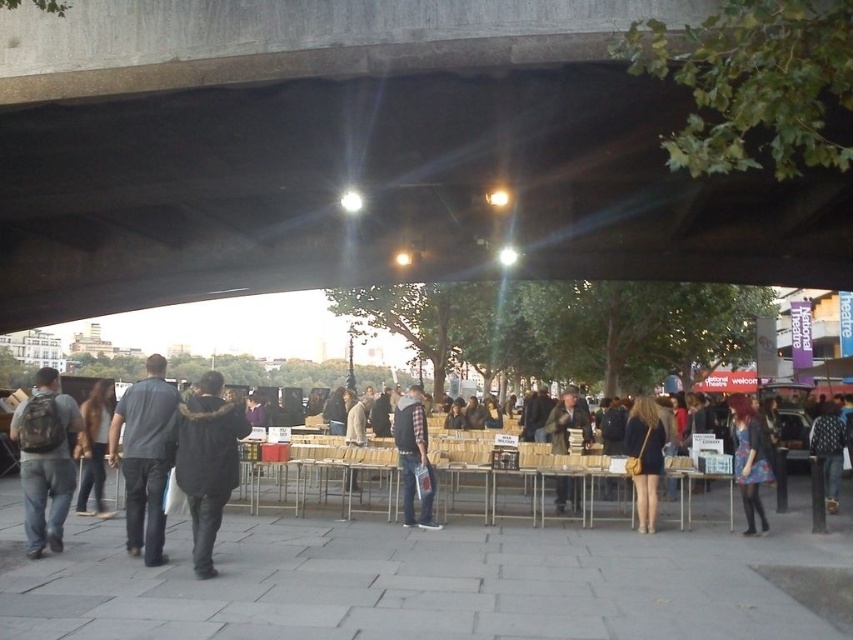
Based on the photo, does dark gray shirt at center have a greater width compared to matte black backpack at left?

In fact, dark gray shirt at center might be narrower than matte black backpack at left.

Between dark gray shirt at center and matte black backpack at left, which one appears on the right side from the viewer's perspective?

From the viewer's perspective, dark gray shirt at center appears more on the right side.

Identify the location of dark gray shirt at center. The width and height of the screenshot is (853, 640). (144, 456).

In order to click on dark gray shirt at center in this screenshot , I will do `click(144, 456)`.

Is the position of concrete at center more distant than that of floral dress at center?

No, concrete at center is closer to the viewer.

Does concrete at center have a larger size compared to floral dress at center?

Correct, concrete at center is larger in size than floral dress at center.

Does point (334, 269) lie behind point (772, 476)?

Yes, point (334, 269) is farther from viewer.

Where is `concrete at center`? The image size is (853, 640). concrete at center is located at coordinates (363, 154).

Can you confirm if dark brown fur-lined coat at center is positioned below matte black backpack at left?

No, dark brown fur-lined coat at center is not below matte black backpack at left.

Is dark brown fur-lined coat at center taller than matte black backpack at left?

In fact, dark brown fur-lined coat at center may be shorter than matte black backpack at left.

Is point (218, 460) less distant than point (39, 428)?

Yes, point (218, 460) is closer to viewer.

You are a GUI agent. You are given a task and a screenshot of the screen. Output one action in this format:
    pyautogui.click(x=<x>, y=<y>)
    Task: Click on the dark brown fur-lined coat at center
    The height and width of the screenshot is (640, 853).
    Given the screenshot: What is the action you would take?
    pyautogui.click(x=207, y=461)